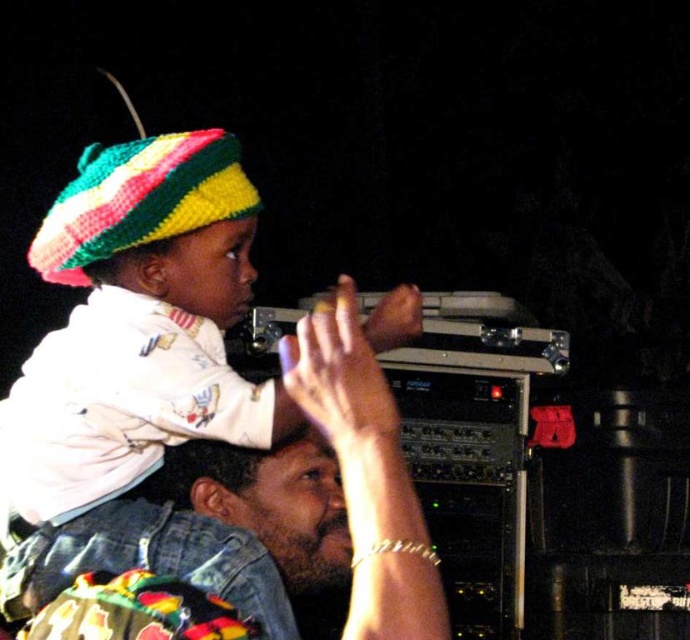
Question: Does jeans at center appear under knitted multicolored hat at upper left?

Choices:
 (A) no
 (B) yes

Answer: (B)

Question: Does gold bracelet at upper center have a smaller size compared to knitted multicolored hat at upper left?

Choices:
 (A) no
 (B) yes

Answer: (A)

Question: Can you confirm if gold bracelet at upper center is bigger than knitted multicolored hat at upper left?

Choices:
 (A) no
 (B) yes

Answer: (B)

Question: Which point is farther from the camera taking this photo?

Choices:
 (A) (346, 444)
 (B) (224, 216)

Answer: (B)

Question: Among these points, which one is nearest to the camera?

Choices:
 (A) (371, 534)
 (B) (39, 241)
 (C) (357, 433)

Answer: (A)

Question: Which is farther from the gold bracelet at upper center?

Choices:
 (A) knitted multicolored hat at upper left
 (B) jeans at center

Answer: (A)